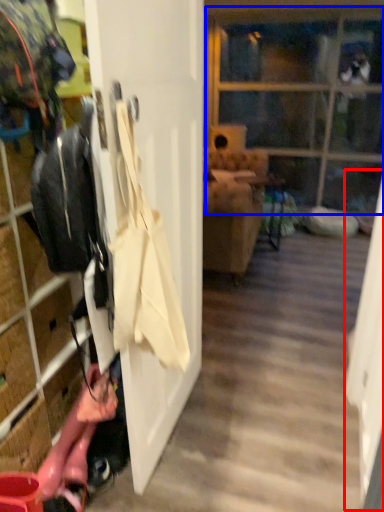
Question: Which object is further to the camera taking this photo, screen door (highlighted by a red box) or glass door (highlighted by a blue box)?

Choices:
 (A) screen door
 (B) glass door

Answer: (B)